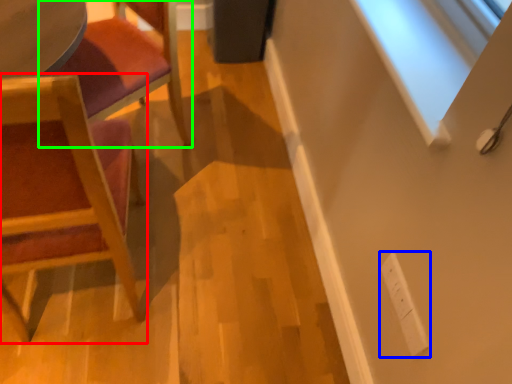
Question: Which object is positioned farthest from chair (highlighted by a red box)? Select from electric outlet (highlighted by a blue box) and chair (highlighted by a green box).

Choices:
 (A) electric outlet
 (B) chair

Answer: (A)